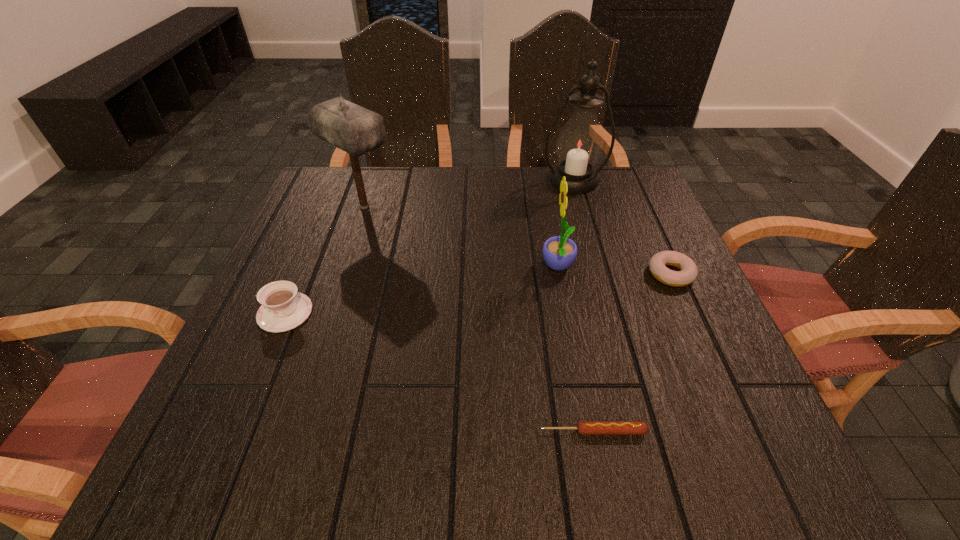
The width and height of the screenshot is (960, 540). Identify the location of the tallest object. (580, 142).

What are the coordinates of `the second tallest object` in the screenshot? It's located at (356, 130).

This screenshot has height=540, width=960. I want to click on sunflower, so [559, 252].

Identify the location of the fourth tallest object. (283, 308).

You are a GUI agent. You are given a task and a screenshot of the screen. Output one action in this format:
    pyautogui.click(x=<x>, y=<y>)
    Task: Click on the fifth farthest object
    
    Given the screenshot: What is the action you would take?
    pyautogui.click(x=283, y=308)

Identify the location of the fifth tallest object. The height and width of the screenshot is (540, 960). (688, 272).

Locate an element on the screen. doughnut is located at coordinates 688,272.

The height and width of the screenshot is (540, 960). Find the location of `sausage`. sausage is located at coordinates (583, 427).

This screenshot has height=540, width=960. What are the coordinates of `the shortest object` in the screenshot? It's located at (583, 427).

Where is `free location located 0.320m on the left of the oil lamp`? This screenshot has height=540, width=960. free location located 0.320m on the left of the oil lamp is located at coordinates (428, 180).